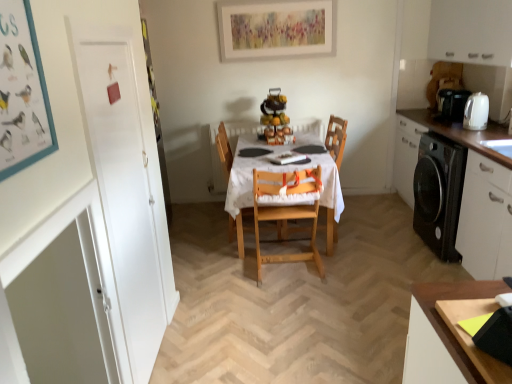
In order to click on vacant region in front of wooden table at center in this screenshot , I will do `click(309, 296)`.